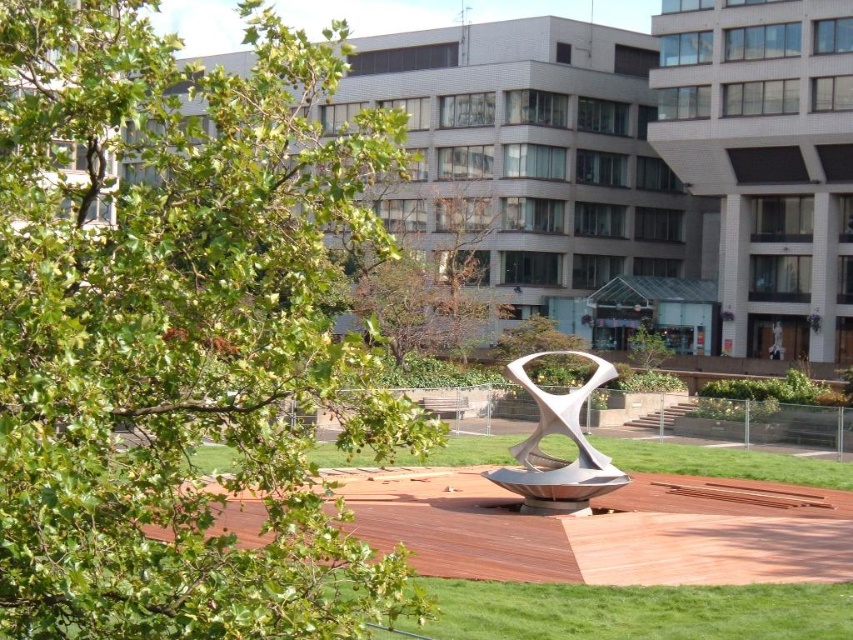
You are planning to place a picnic blanket in the urban park. The brown leafy tree at center and the green grass at center are both in your view. Considering their sizes, which area would provide more space for the blanket?

The green grass at center would provide more space for the picnic blanket since the brown leafy tree at center is larger in size and may occupy more area, leaving less space compared to the green grass at center.

You are a park visitor who wants to take a clear photo of the satin silver sculpture at center without any obstruction. Given that the brown leafy tree at center is blocking part of it, can you suggest a direction to move so that the tree no longer blocks your view?

The brown leafy tree at center is positioned over the satin silver sculpture at center. To take a clear photo of the satin silver sculpture at center without obstruction, you should move to a position where you can view the sculpture from below the tree, such as crouching or moving to a lower angle, so the tree no longer blocks the view.

You are standing at the entrance of the park and want to find the brown leafy tree at center. According to the coordinates provided, in which direction should you move from your current position to reach it?

The brown leafy tree at center is located at coordinates point (x=433, y=284). Since you are at the entrance, you should move towards the center of the park to reach it.